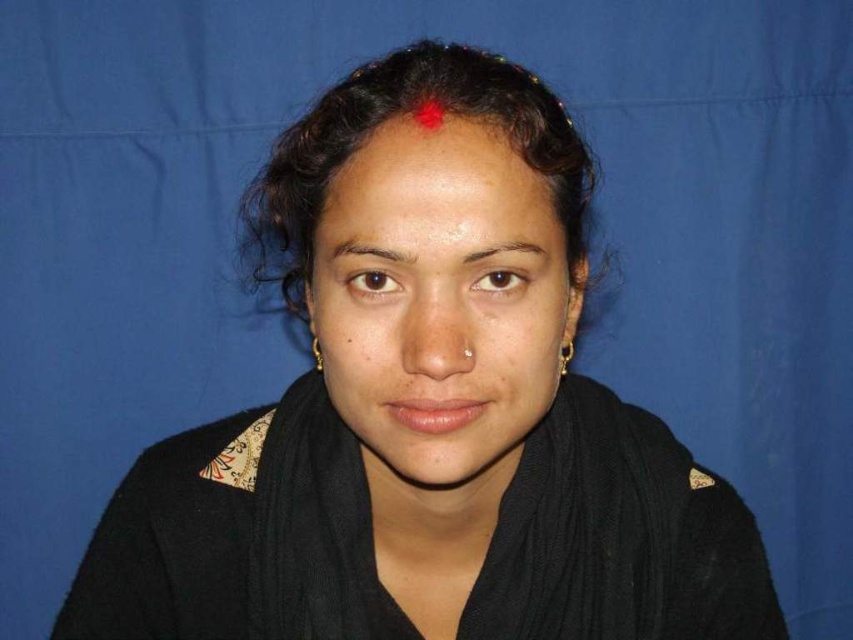
Which is more to the left, black knitted scarf at center or matte skin forehead at center?

matte skin forehead at center is more to the left.

In order to click on black knitted scarf at center in this screenshot , I will do `click(583, 525)`.

I want to click on black knitted scarf at center, so click(x=583, y=525).

Who is positioned more to the left, matte skin forehead at center or brown matte eyebrow at center?

From the viewer's perspective, matte skin forehead at center appears more on the left side.

Does point (460, 225) lie behind point (527, 252)?

No.

The height and width of the screenshot is (640, 853). I want to click on matte skin forehead at center, so click(434, 179).

In the scene shown: Can you confirm if matte skin forehead at center is thinner than brown smooth eyebrow at upper center?

No, matte skin forehead at center is not thinner than brown smooth eyebrow at upper center.

Is matte skin forehead at center to the left of brown smooth eyebrow at upper center from the viewer's perspective?

In fact, matte skin forehead at center is to the right of brown smooth eyebrow at upper center.

Measure the distance between matte skin forehead at center and camera.

They are 17.49 inches apart.

Locate an element on the screen. matte skin forehead at center is located at coordinates (434, 179).